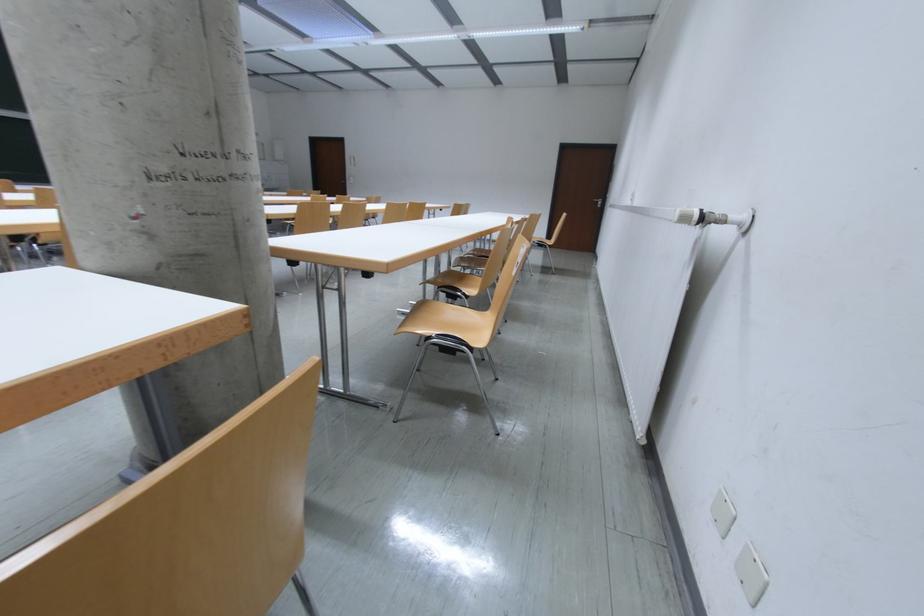
What are the coordinates of `silver door handle` in the screenshot? It's located at (598, 201).